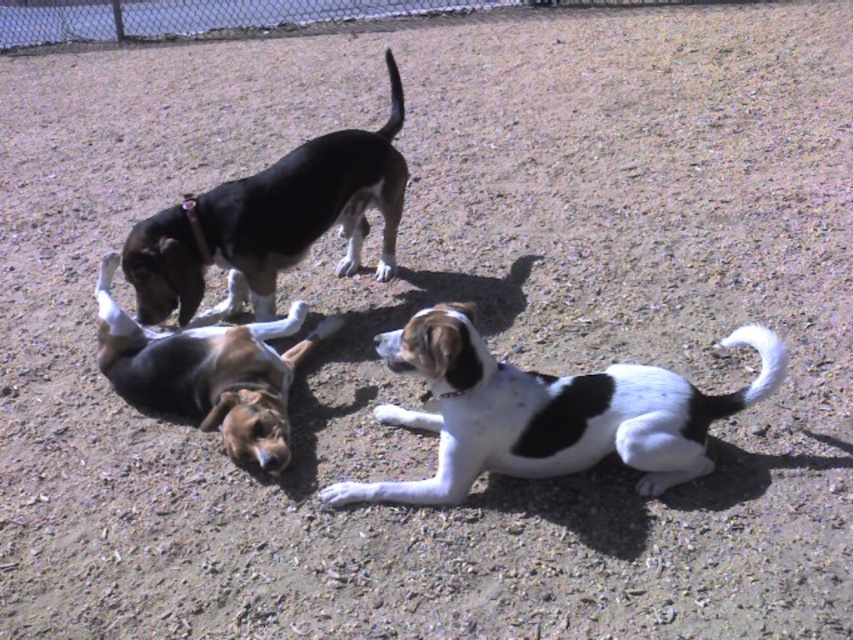
Can you confirm if white-spotted fur dog at center is shorter than metallic chain-link fence at upper center?

In fact, white-spotted fur dog at center may be taller than metallic chain-link fence at upper center.

Which is more to the right, white-spotted fur dog at center or metallic chain-link fence at upper center?

From the viewer's perspective, white-spotted fur dog at center appears more on the right side.

Does point (426, 314) lie behind point (582, 1)?

No.

You are a GUI agent. You are given a task and a screenshot of the screen. Output one action in this format:
    pyautogui.click(x=<x>, y=<y>)
    Task: Click on the white-spotted fur dog at center
    The height and width of the screenshot is (640, 853).
    Given the screenshot: What is the action you would take?
    pyautogui.click(x=547, y=412)

Can you confirm if white-spotted fur dog at center is taller than black and white fur dog at upper left?

Incorrect, white-spotted fur dog at center's height is not larger of black and white fur dog at upper left's.

Locate an element on the screen. The image size is (853, 640). white-spotted fur dog at center is located at coordinates (547, 412).

Can you confirm if black and white fur dog at upper left is positioned above brown and white fur dog at lower left?

Yes, black and white fur dog at upper left is above brown and white fur dog at lower left.

You are a GUI agent. You are given a task and a screenshot of the screen. Output one action in this format:
    pyautogui.click(x=<x>, y=<y>)
    Task: Click on the black and white fur dog at upper left
    
    Given the screenshot: What is the action you would take?
    pyautogui.click(x=271, y=221)